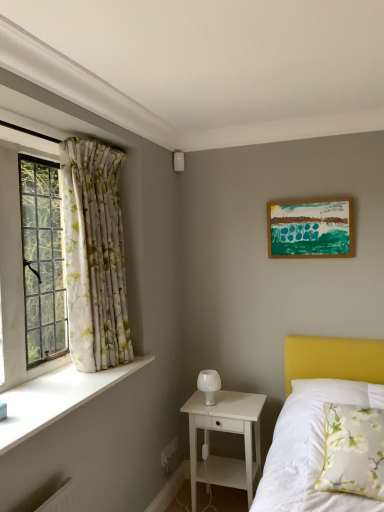
Where is `blank space situated above white floral pillow at lower right (from a real-world perspective)`? blank space situated above white floral pillow at lower right (from a real-world perspective) is located at coordinates (364, 405).